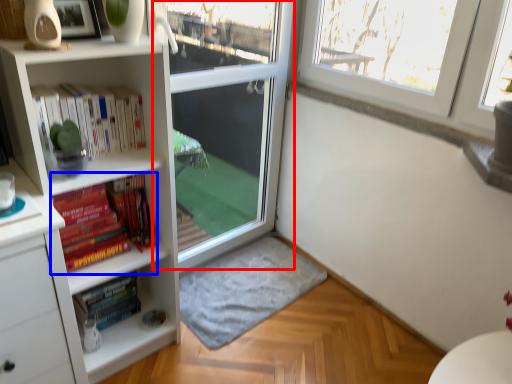
Question: Which point is closer to the camera, screen door (highlighted by a red box) or book (highlighted by a blue box)?

Choices:
 (A) screen door
 (B) book

Answer: (B)